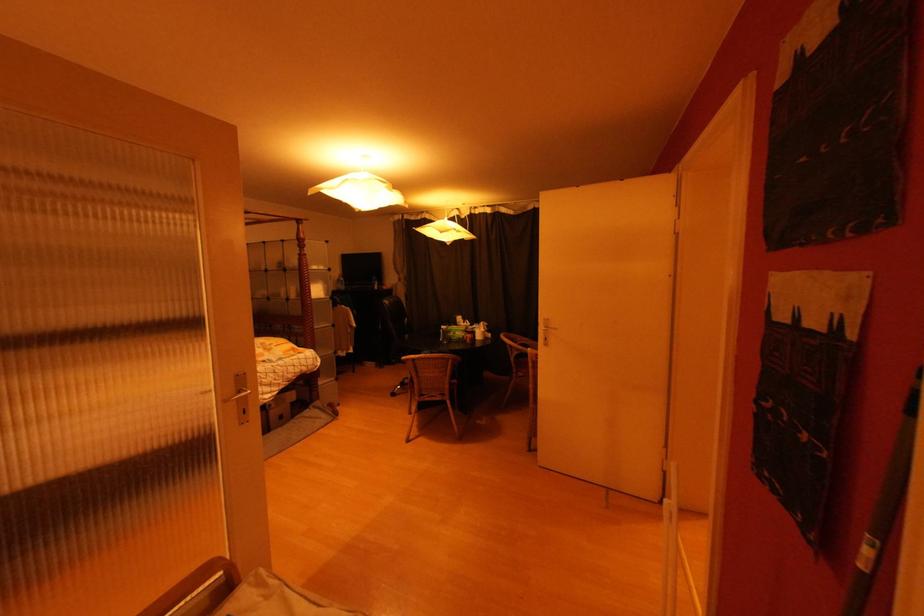
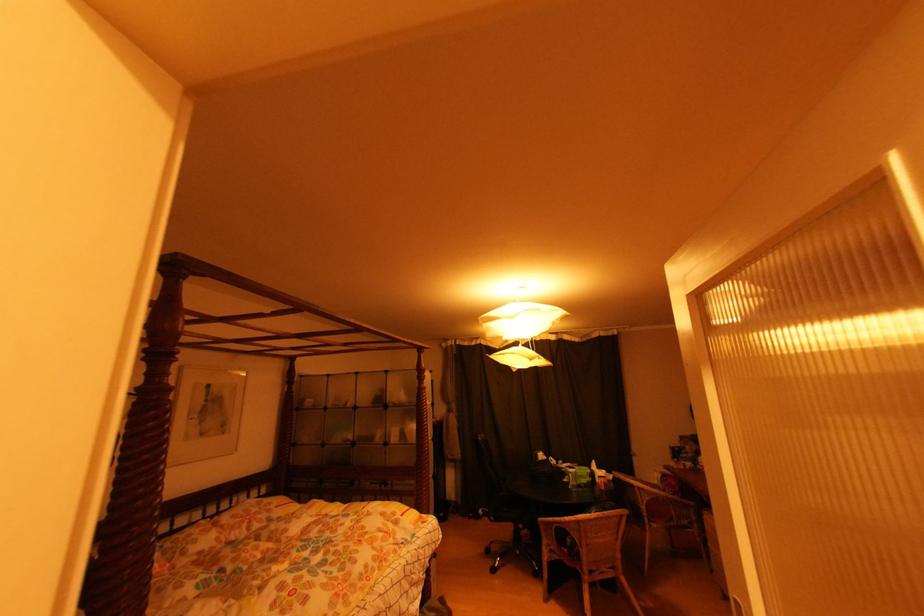
Question: Which direction would the cameraman need to move to produce the second image? Reply with the corresponding letter.

Choices:
 (A) Left
 (B) Right
 (C) Forward
 (D) Backward

Answer: (A)